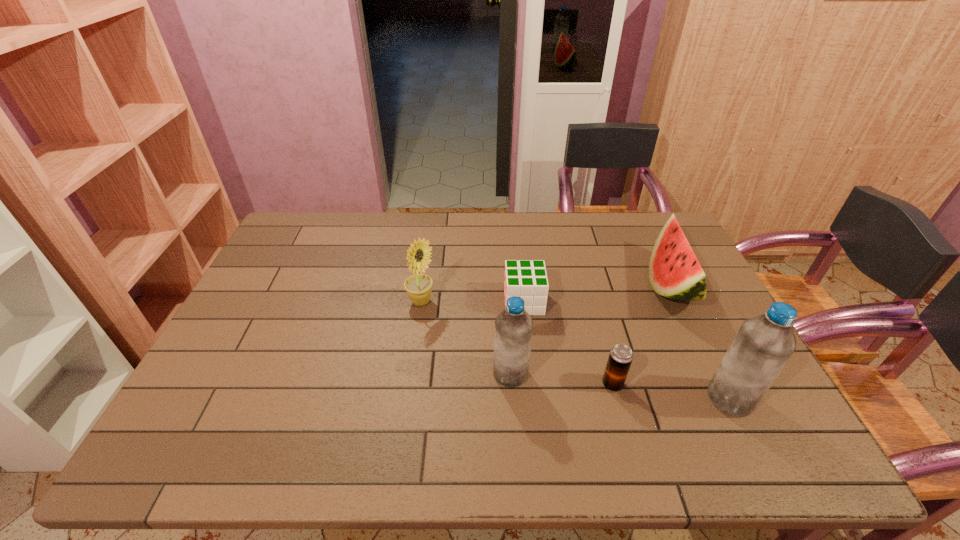
Please point a free position for a water bottle on the left. Please provide its 2D coordinates. Your answer should be formatted as a tuple, i.e. [(x, y)], where the tuple contains the x and y coordinates of a point satisfying the conditions above.

[(311, 352)]